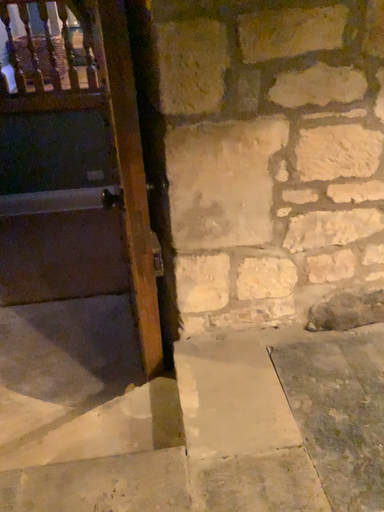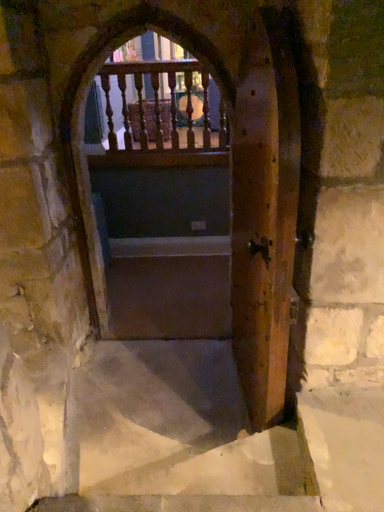
Question: Which way did the camera rotate in the video?

Choices:
 (A) rotated upward
 (B) rotated downward

Answer: (A)